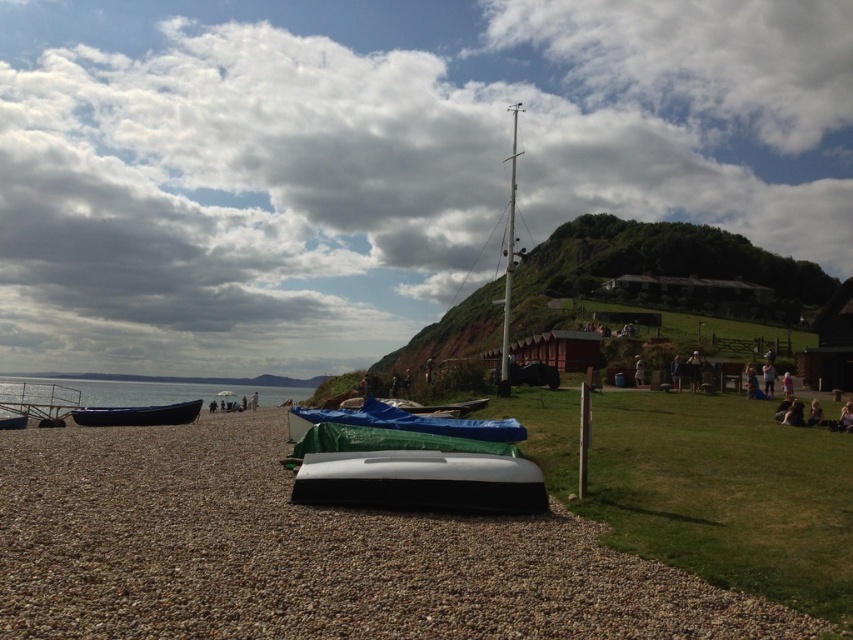
Does white matte boat at center have a greater height compared to green tarpaulin boat at center?

Incorrect, white matte boat at center's height is not larger of green tarpaulin boat at center's.

Who is taller, white matte boat at center or green tarpaulin boat at center?

Standing taller between the two is green tarpaulin boat at center.

Between point (380, 493) and point (399, 422), which one is positioned behind?

The point (399, 422) is behind.

Image resolution: width=853 pixels, height=640 pixels. I want to click on white matte boat at center, so click(x=421, y=481).

Consider the image. Can you confirm if green grassy hillside at upper right is bigger than blue plastic boat at left?

Yes, green grassy hillside at upper right is bigger than blue plastic boat at left.

Which is more to the right, green grassy hillside at upper right or blue plastic boat at left?

From the viewer's perspective, green grassy hillside at upper right appears more on the right side.

Is point (521, 268) behind point (187, 408)?

Yes, it is behind point (187, 408).

Image resolution: width=853 pixels, height=640 pixels. Identify the location of green grassy hillside at upper right. (654, 266).

Does point (556, 252) lie behind point (364, 406)?

That is True.

Where is `green grassy hillside at upper right`? green grassy hillside at upper right is located at coordinates (654, 266).